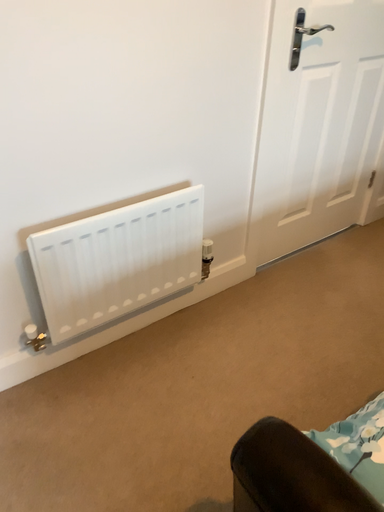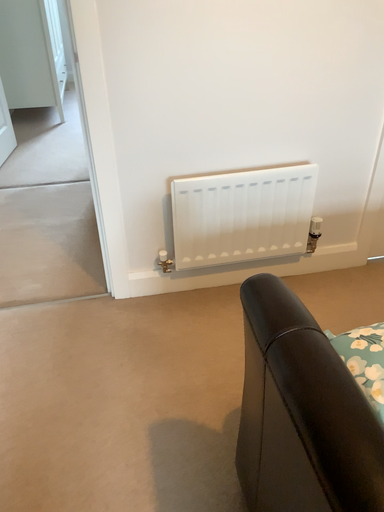
Question: Which way did the camera rotate in the video?

Choices:
 (A) rotated left
 (B) rotated right

Answer: (A)